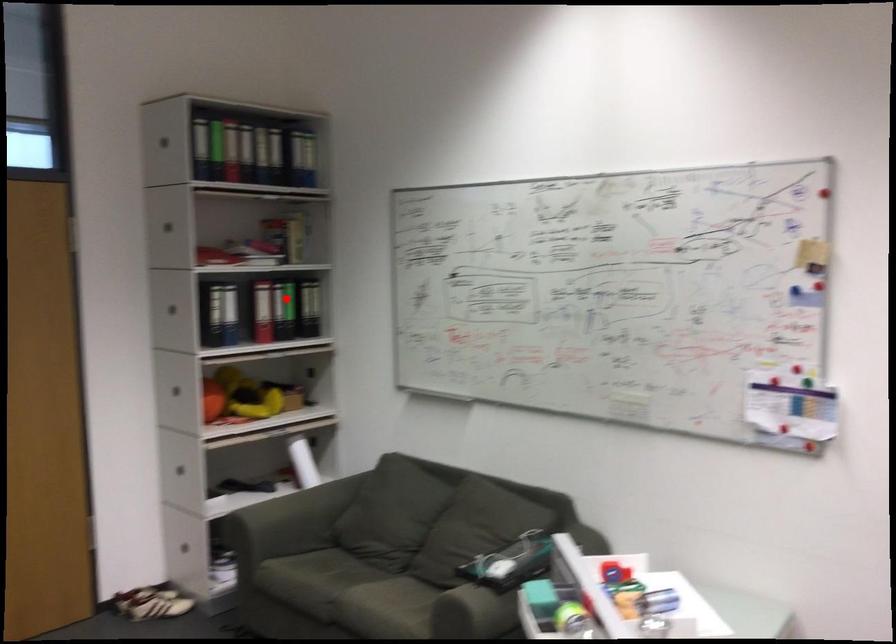
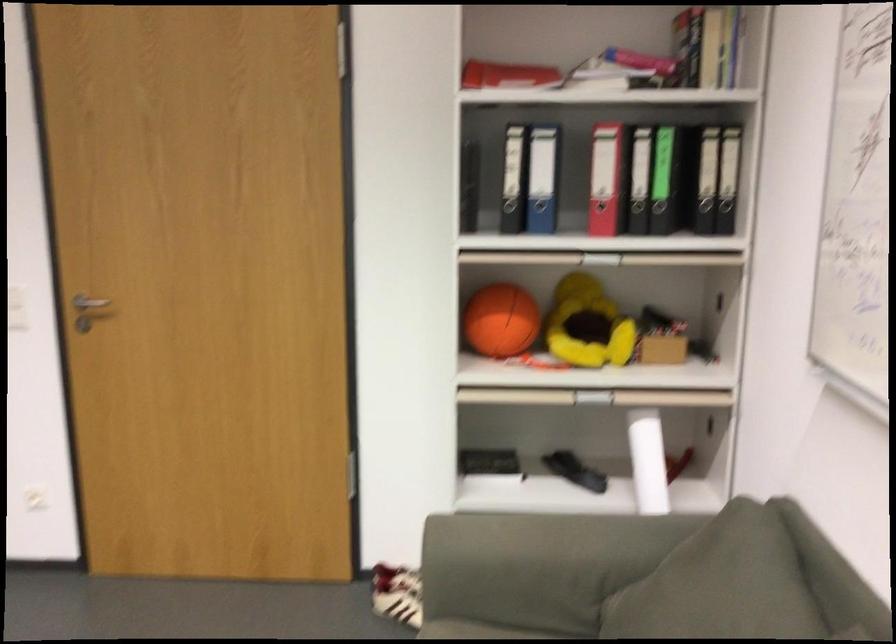
Question: I am providing you with two images of the same scene from different viewpoints. Given a red point in image1, look at the same physical point in image2. Is it:

Choices:
 (A) Closer to the viewpoint
 (B) Farther from the viewpoint

Answer: (A)